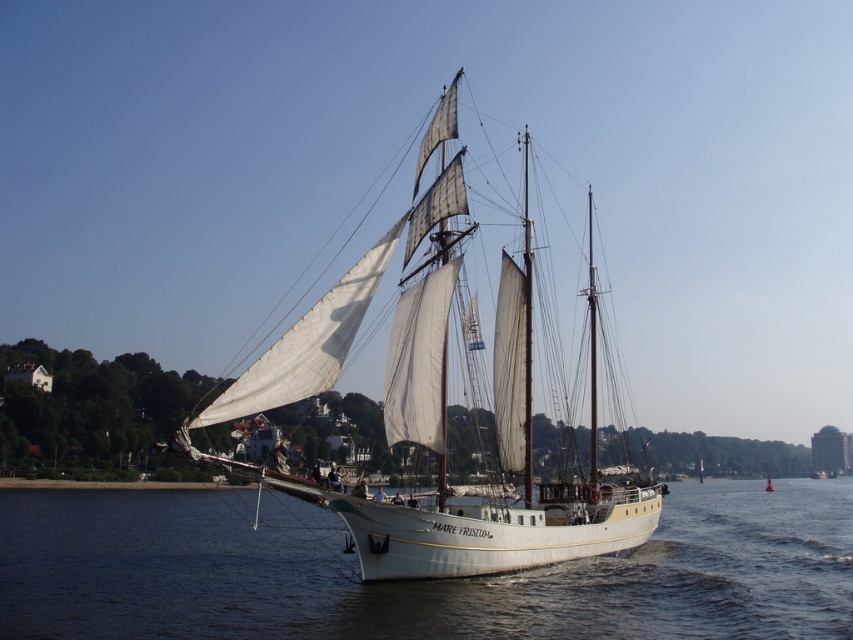
Can you confirm if white water at center is bigger than white canvas sailboat at center?

Incorrect, white water at center is not larger than white canvas sailboat at center.

Does white water at center appear over white canvas sailboat at center?

Incorrect, white water at center is not positioned above white canvas sailboat at center.

Is point (674, 588) positioned behind point (402, 520)?

That is True.

Locate an element on the screen. The width and height of the screenshot is (853, 640). white water at center is located at coordinates (416, 582).